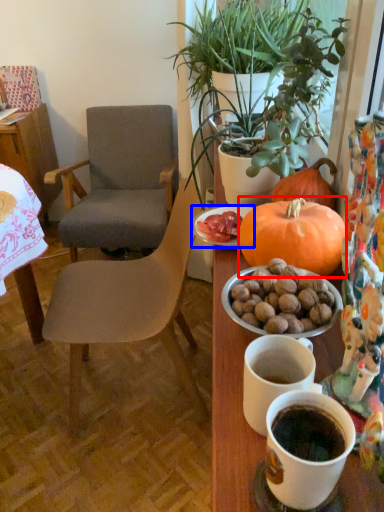
Question: Which object appears closest to the camera in this image, pumpkin (highlighted by a red box) or plate (highlighted by a blue box)?

Choices:
 (A) pumpkin
 (B) plate

Answer: (A)